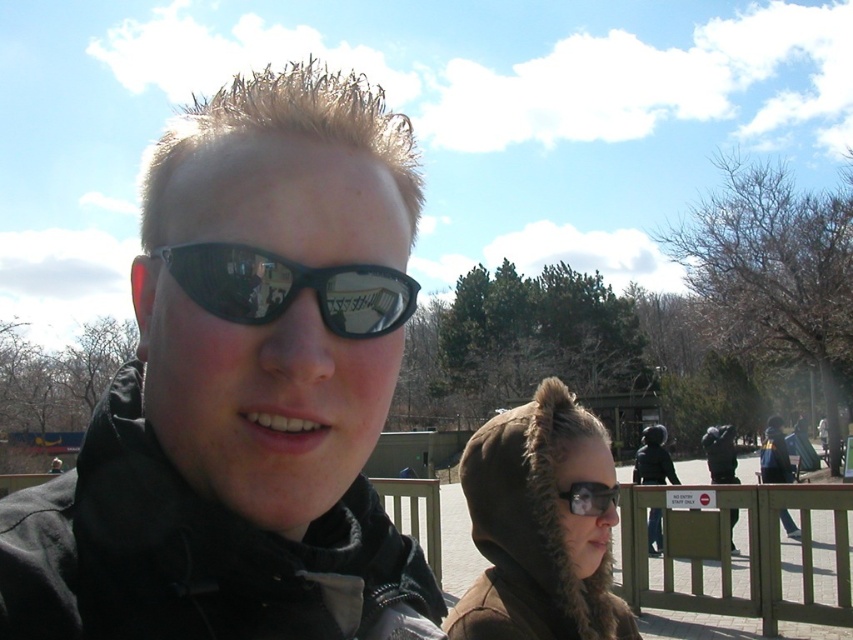
You are standing at the point marked as point [740,556] in the image. What object is located exactly at this coordinate?

The wooden fence at lower right is located exactly at point [740,556].